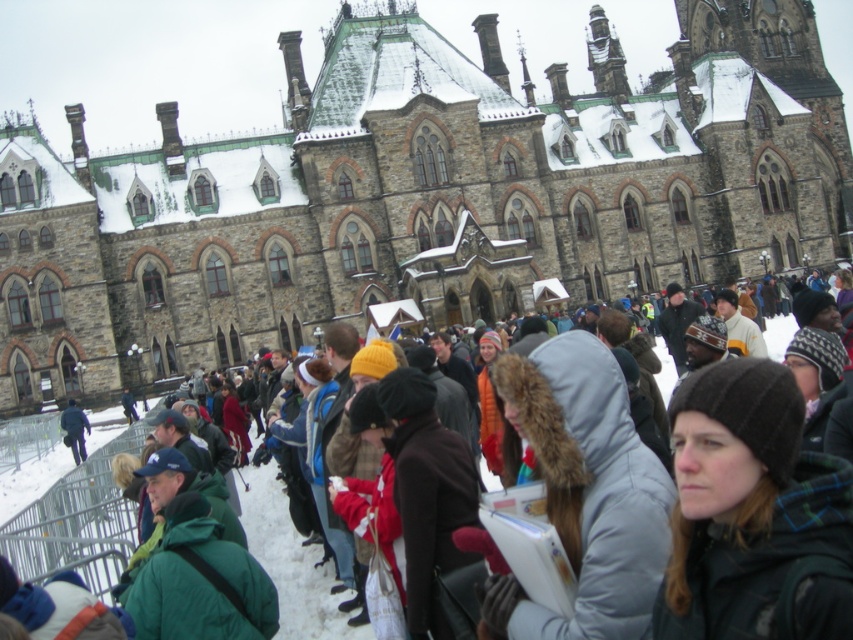
You are a photographer trying to capture the stone church at center and the dark blue jacket at center in a single shot. Based on their sizes, which one should you focus on to ensure both are visible in the frame?

The stone church at center is larger in size than the dark blue jacket at center, so focusing on the stone church at center will ensure both are visible in the frame since it occupies more space.

You are an architect assessing the height of the stone church at center and the dark blue jacket at center in the winter scene. Which object is taller?

The stone church at center is taller than the dark blue jacket at center according to the description.